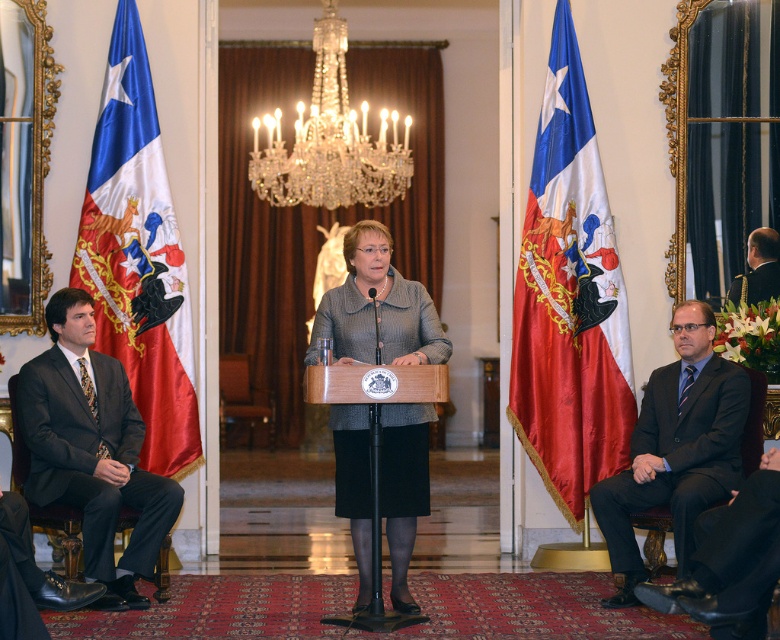
You are standing at the center of the room and looking towards the podium. There are two points marked in the image, point 1 at coordinates point (x=147, y=122) and point 2 at coordinates point (x=761, y=228). Which point is closer to you?

Point 1 at coordinates point (x=147, y=122) is closer to you because it is in front of point 2 at coordinates point (x=761, y=228).

You are attending an official event and need to locate the dark blue suit at right and the silky red flag at left. Based on their positions, which object is located to the east of the other?

The silky red flag at left is positioned on the left side of dark blue suit at right, so the silky red flag at left is east of the dark blue suit at right.